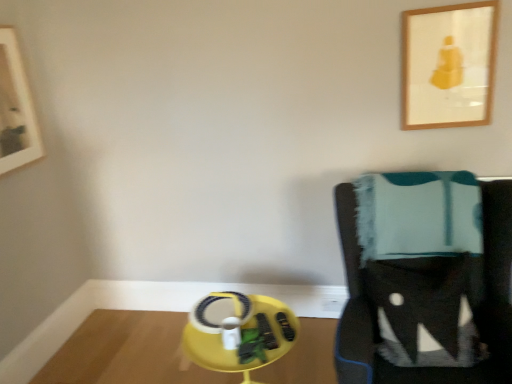
Question: Is the depth of yellow plastic table at lower center greater than that of wooden picture frame at upper right, marked as the first picture frame in a right-to-left arrangement?

Choices:
 (A) yes
 (B) no

Answer: (A)

Question: Is yellow plastic table at lower center taller than wooden picture frame at upper right, marked as the first picture frame in a right-to-left arrangement?

Choices:
 (A) no
 (B) yes

Answer: (A)

Question: Is there a large distance between yellow plastic table at lower center and wooden picture frame at upper right, the second picture frame when ordered from left to right?

Choices:
 (A) no
 (B) yes

Answer: (B)

Question: Is yellow plastic table at lower center turned away from wooden picture frame at upper right, marked as the first picture frame in a right-to-left arrangement?

Choices:
 (A) yes
 (B) no

Answer: (B)

Question: Does yellow plastic table at lower center have a greater width compared to wooden picture frame at upper right, the second picture frame when ordered from left to right?

Choices:
 (A) no
 (B) yes

Answer: (B)

Question: Considering the positions of wooden picture frame at upper right, marked as the first picture frame in a right-to-left arrangement, and yellow plastic round table at lower center in the image, is wooden picture frame at upper right, marked as the first picture frame in a right-to-left arrangement, wider or thinner than yellow plastic round table at lower center?

Choices:
 (A) wide
 (B) thin

Answer: (B)

Question: In terms of height, does wooden picture frame at upper right, the second picture frame when ordered from left to right, look taller or shorter compared to yellow plastic round table at lower center?

Choices:
 (A) tall
 (B) short

Answer: (B)

Question: Is wooden picture frame at upper right, marked as the first picture frame in a right-to-left arrangement, to the left or to the right of yellow plastic round table at lower center in the image?

Choices:
 (A) right
 (B) left

Answer: (A)

Question: Considering the positions of point (493, 34) and point (246, 347), is point (493, 34) closer or farther from the camera than point (246, 347)?

Choices:
 (A) farther
 (B) closer

Answer: (A)

Question: Do you think wooden picture frame at upper left, positioned as the second picture frame in right-to-left order, is within knitted wool blanket at right, or outside of it?

Choices:
 (A) inside
 (B) outside

Answer: (B)

Question: Considering the positions of wooden picture frame at upper left, the 1th picture frame from the left, and knitted wool blanket at right in the image, is wooden picture frame at upper left, the 1th picture frame from the left, bigger or smaller than knitted wool blanket at right?

Choices:
 (A) big
 (B) small

Answer: (B)

Question: Is wooden picture frame at upper left, the 1th picture frame from the left, in front of or behind knitted wool blanket at right in the image?

Choices:
 (A) behind
 (B) front

Answer: (A)

Question: Is wooden picture frame at upper left, the 1th picture frame from the left, wider or thinner than knitted wool blanket at right?

Choices:
 (A) wide
 (B) thin

Answer: (B)

Question: Is wooden picture frame at upper right, the second picture frame when ordered from left to right, taller or shorter than wooden picture frame at upper left, positioned as the second picture frame in right-to-left order?

Choices:
 (A) short
 (B) tall

Answer: (A)

Question: Considering the relative positions of wooden picture frame at upper right, marked as the first picture frame in a right-to-left arrangement, and wooden picture frame at upper left, positioned as the second picture frame in right-to-left order, in the image provided, is wooden picture frame at upper right, marked as the first picture frame in a right-to-left arrangement, to the left or to the right of wooden picture frame at upper left, positioned as the second picture frame in right-to-left order,?

Choices:
 (A) left
 (B) right

Answer: (B)